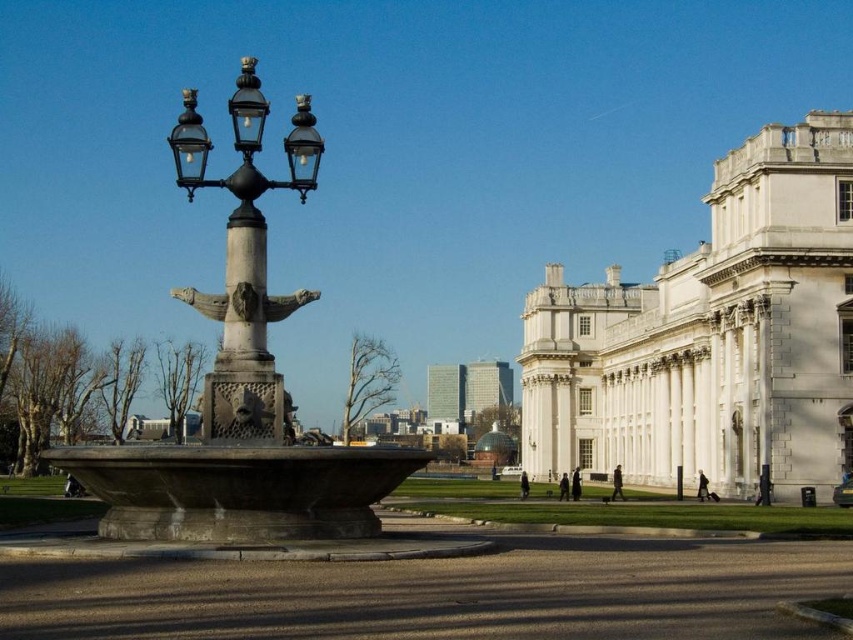
Can you confirm if stone fountain at center is wider than matte black street light at center left?

Indeed, stone fountain at center has a greater width compared to matte black street light at center left.

Can you confirm if stone fountain at center is positioned to the right of matte black street light at center left?

Incorrect, stone fountain at center is not on the right side of matte black street light at center left.

Which is behind, point (206, 506) or point (236, 131)?

The point (206, 506) is more distant.

At what (x,y) coordinates should I click in order to perform the action: click on stone fountain at center. Please return your answer as a coordinate pair (x, y). This screenshot has height=640, width=853. Looking at the image, I should click on (241, 387).

Which is in front, point (734, 269) or point (316, 461)?

Point (316, 461) is more forward.

Does point (556, 342) lie in front of point (171, 493)?

That is False.

Locate an element on the screen. white stone building at center-right is located at coordinates (711, 336).

Between white stone building at center-right and matte black street light at center left, which one appears on the right side from the viewer's perspective?

white stone building at center-right

Does white stone building at center-right appear on the right side of matte black street light at center left?

Correct, you'll find white stone building at center-right to the right of matte black street light at center left.

Image resolution: width=853 pixels, height=640 pixels. Describe the element at coordinates (711, 336) in the screenshot. I see `white stone building at center-right` at that location.

Locate an element on the screen. white stone building at center-right is located at coordinates (711, 336).